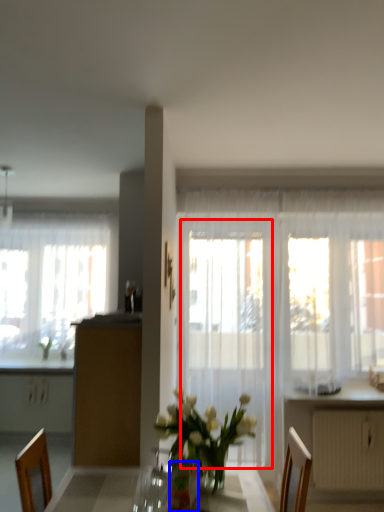
Question: Which object appears closest to the camera in this image, screen door (highlighted by a red box) or vase (highlighted by a blue box)?

Choices:
 (A) screen door
 (B) vase

Answer: (B)